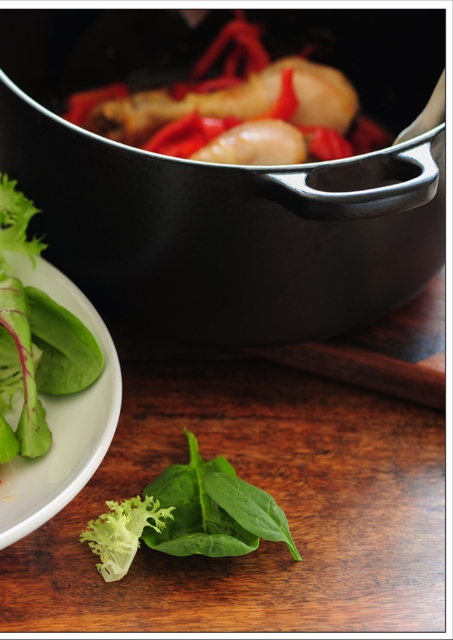
Can you confirm if black matte frying pan at upper center is taller than green leafy plate at lower left?

Yes, black matte frying pan at upper center is taller than green leafy plate at lower left.

Who is more distant from viewer, (425, 182) or (30, 472)?

Positioned behind is point (30, 472).

The width and height of the screenshot is (453, 640). What are the coordinates of `black matte frying pan at upper center` in the screenshot? It's located at (205, 198).

Who is taller, black matte frying pan at upper center or green leafy at lower left?

black matte frying pan at upper center

Measure the distance between black matte frying pan at upper center and green leafy at lower left.

They are 27.43 centimeters apart.

Is point (337, 12) farther from camera compared to point (258, 490)?

Yes.

What are the coordinates of `black matte frying pan at upper center` in the screenshot? It's located at (205, 198).

Which is more to the right, green leafy at lower left or green leafy plate at lower left?

green leafy at lower left

Can you confirm if green leafy at lower left is smaller than green leafy plate at lower left?

Yes, green leafy at lower left is smaller than green leafy plate at lower left.

Locate an element on the screen. The image size is (453, 640). green leafy at lower left is located at coordinates (187, 516).

The width and height of the screenshot is (453, 640). Identify the location of green leafy at lower left. (187, 516).